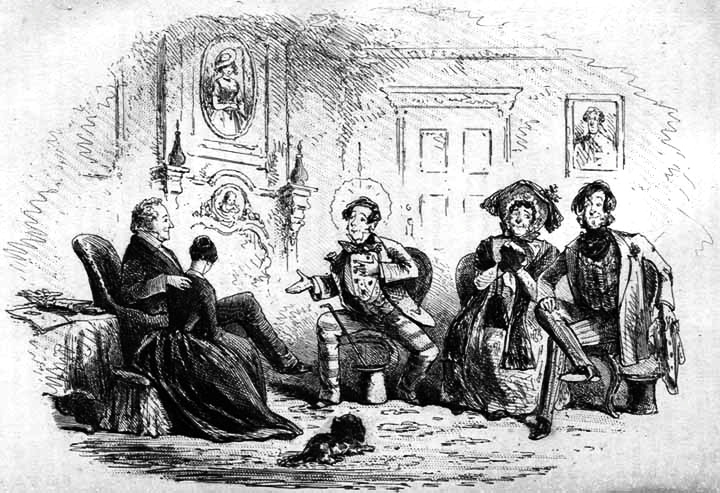
This screenshot has height=493, width=720. I want to click on door, so click(x=451, y=141), click(x=435, y=189), click(x=456, y=210).